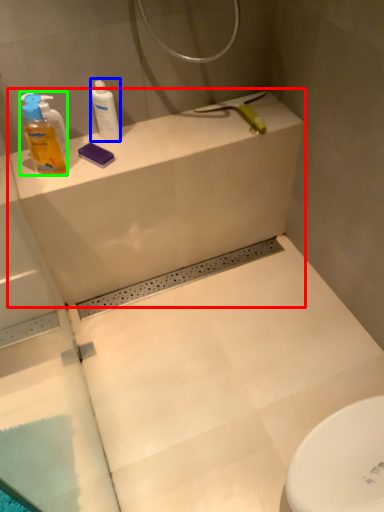
Question: Based on their relative distances, which object is farther from counter top (highlighted by a red box)? Choose from cleaning product (highlighted by a blue box) and cleaning product (highlighted by a green box).

Choices:
 (A) cleaning product
 (B) cleaning product

Answer: (B)